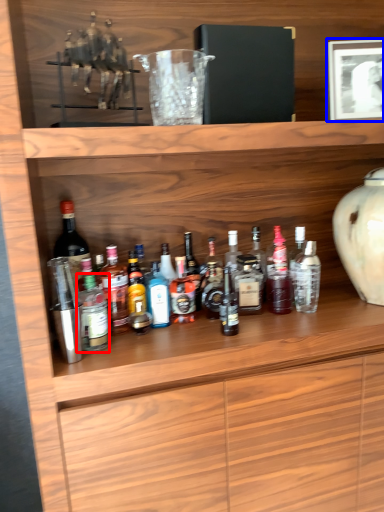
Question: Which of the following is the closest to the observer, bottle (highlighted by a red box) or picture frame (highlighted by a blue box)?

Choices:
 (A) bottle
 (B) picture frame

Answer: (A)